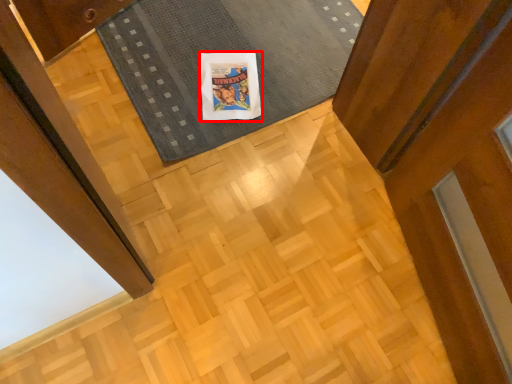
Question: From the image, what is the correct spatial relationship of comic book character (annotated by the red box) in relation to mat?

Choices:
 (A) right
 (B) left

Answer: (B)